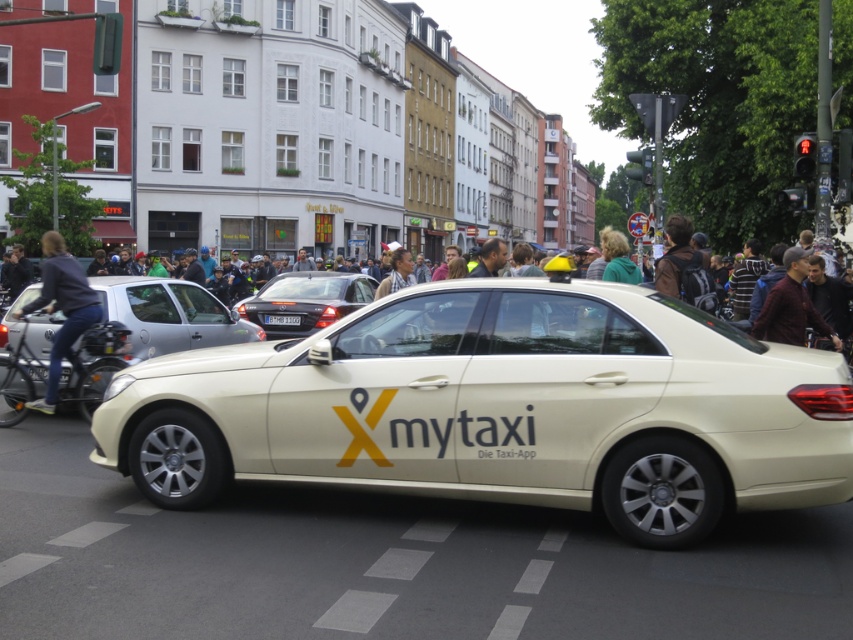
Question: Which point is farther from the camera taking this photo?

Choices:
 (A) (357, 291)
 (B) (831, 332)
 (C) (225, 324)

Answer: (A)

Question: Which is nearer to the denim jacket at left?

Choices:
 (A) white plastic license plate at center
 (B) metallic silver sedan at center
 (C) matte white taxi at center
 (D) dark brown leather jacket at right

Answer: (B)

Question: Considering the relative positions of metallic silver sedan at center and white plastic license plate at center in the image provided, where is metallic silver sedan at center located with respect to white plastic license plate at center?

Choices:
 (A) right
 (B) left

Answer: (B)

Question: Is matte white taxi at center further to camera compared to metallic silver sedan at center?

Choices:
 (A) yes
 (B) no

Answer: (B)

Question: Which point is farther from the camera taking this photo?

Choices:
 (A) (695, 477)
 (B) (16, 312)
 (C) (346, 273)

Answer: (C)

Question: Can you confirm if matte white taxi at center is positioned to the right of denim jacket at left?

Choices:
 (A) no
 (B) yes

Answer: (B)